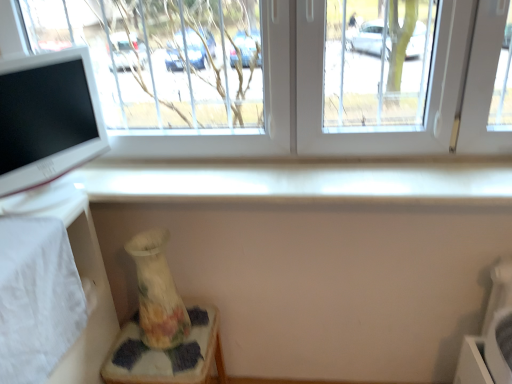
Question: In the image, is transparent glass window at upper center on the left side or the right side of floral-patterned ceramic vase at lower left?

Choices:
 (A) right
 (B) left

Answer: (A)

Question: From their relative heights in the image, would you say transparent glass window at upper center is taller or shorter than floral-patterned ceramic vase at lower left?

Choices:
 (A) tall
 (B) short

Answer: (A)

Question: Which object is the closest to the white glossy computer monitor at left?

Choices:
 (A) floral-patterned ceramic vase at lower left
 (B) transparent glass window at upper center
 (C) white fabric table at lower left
 (D) porcelain floral vase at lower left

Answer: (C)

Question: Which is nearer to the porcelain floral vase at lower left?

Choices:
 (A) transparent glass window at upper center
 (B) white glossy computer monitor at left
 (C) white fabric table at lower left
 (D) floral-patterned ceramic vase at lower left

Answer: (D)